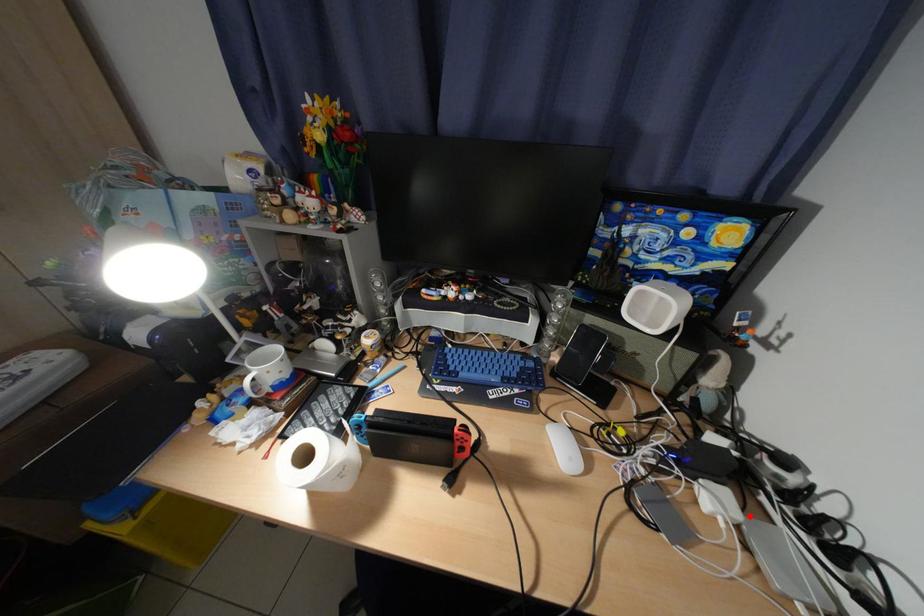
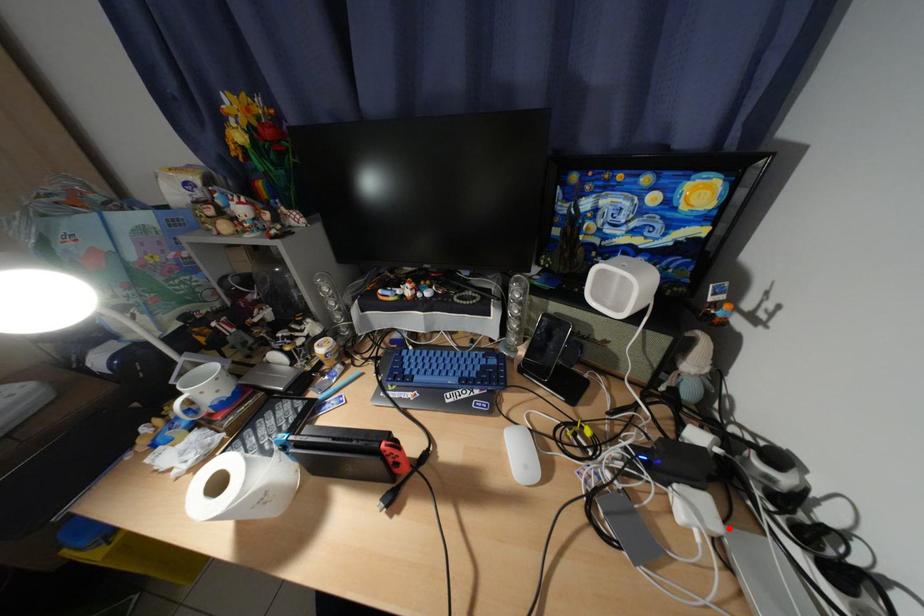
From the picture: I am providing you with two images of the same scene from different viewpoints. A red point is marked on the first image and another point is marked on the second image. Are the points marked in image1 and image2 representing the same 3D position?

Yes